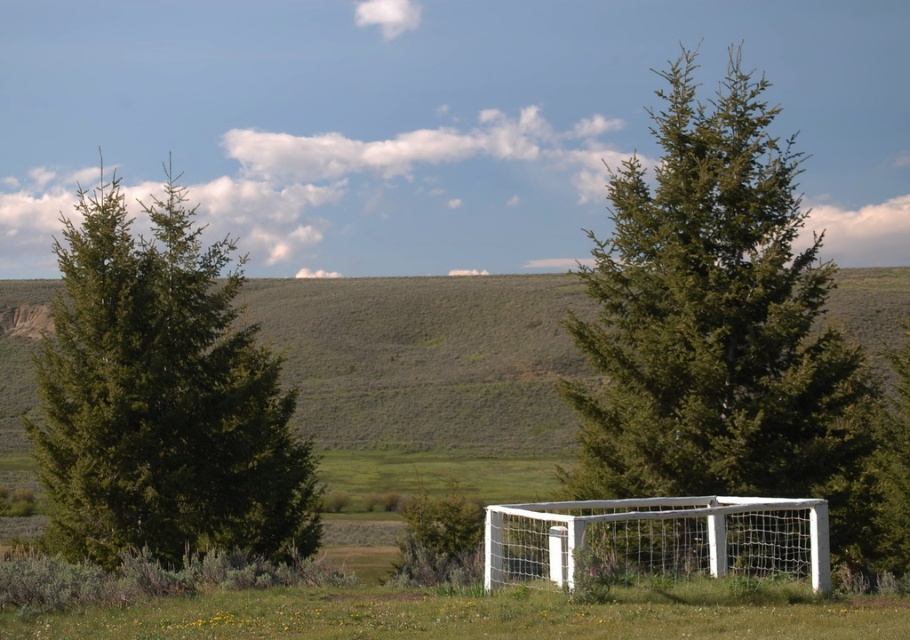
Question: Considering the real-world distances, which object is closest to the white mesh net at center?

Choices:
 (A) green grassy hillside at center
 (B) green matte tree at center
 (C) green matte tree at left

Answer: (C)

Question: Can you confirm if green grassy hillside at center is positioned below white mesh net at center?

Choices:
 (A) no
 (B) yes

Answer: (A)

Question: Which object is closer to the camera taking this photo?

Choices:
 (A) green grassy hillside at center
 (B) green matte tree at left
 (C) green matte tree at center
 (D) white mesh net at center

Answer: (D)

Question: Which object is positioned closest to the green matte tree at center?

Choices:
 (A) green grassy hillside at center
 (B) green matte tree at left

Answer: (A)

Question: Does green matte tree at center appear over green matte tree at left?

Choices:
 (A) yes
 (B) no

Answer: (A)

Question: Is green grassy hillside at center further to camera compared to white mesh net at center?

Choices:
 (A) yes
 (B) no

Answer: (A)